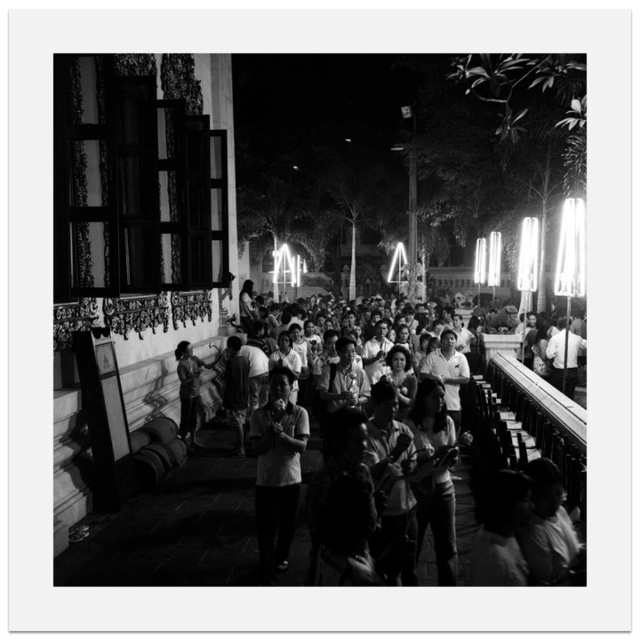
Does smooth skin person at center appear on the right side of dark skin textured shirt at center?

Correct, you'll find smooth skin person at center to the right of dark skin textured shirt at center.

Is smooth skin person at center closer to the viewer compared to dark skin textured shirt at center?

That is True.

The width and height of the screenshot is (640, 640). I want to click on smooth skin person at center, so click(502, 467).

Which of these two, smooth skin person at center or white matte shirt at center, stands shorter?

With less height is white matte shirt at center.

Which is above, smooth skin person at center or white matte shirt at center?

Positioned higher is smooth skin person at center.

Does point (470, 492) come farther from viewer compared to point (262, 428)?

Yes, point (470, 492) is behind point (262, 428).

Find the location of a particular element. Image resolution: width=640 pixels, height=640 pixels. smooth skin person at center is located at coordinates click(x=502, y=467).

Is white matte shirt at center bigger than dark skin textured shirt at center?

No.

Does point (282, 554) come behind point (195, 416)?

No, it is in front of (195, 416).

You are a GUI agent. You are given a task and a screenshot of the screen. Output one action in this format:
    pyautogui.click(x=<x>, y=<y>)
    Task: Click on the white matte shirt at center
    The width and height of the screenshot is (640, 640).
    Given the screenshot: What is the action you would take?
    pyautogui.click(x=276, y=470)